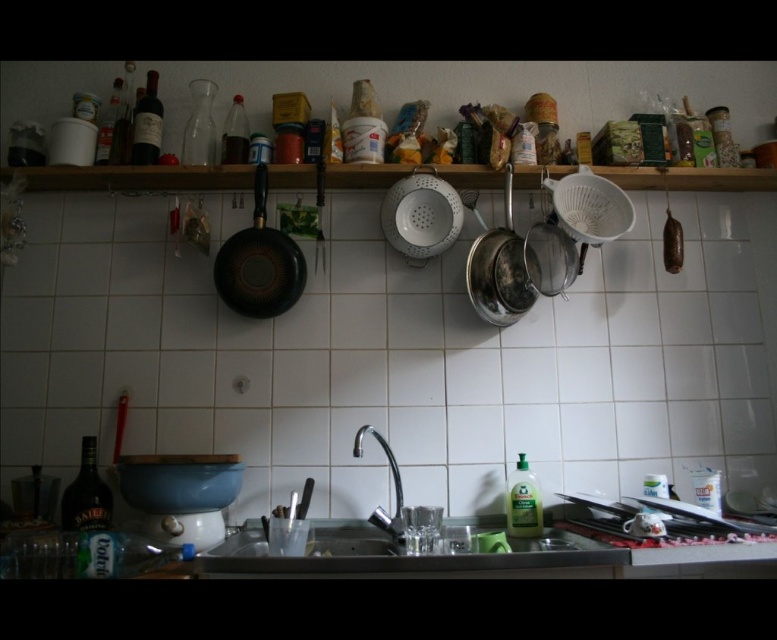
You are trying to place a new dish rack that is 1.2 meters wide in the kitchen. The dish rack needs to fit horizontally between the stainless steel sink at lower center and the black matte frying pan at upper left. Can it fit?

The stainless steel sink at lower center is wider than the black matte frying pan at upper left. However, the distance between them isn not specified in the objects description. Therefore, it is impossible to determine if the dish rack will fit based on the provided information.